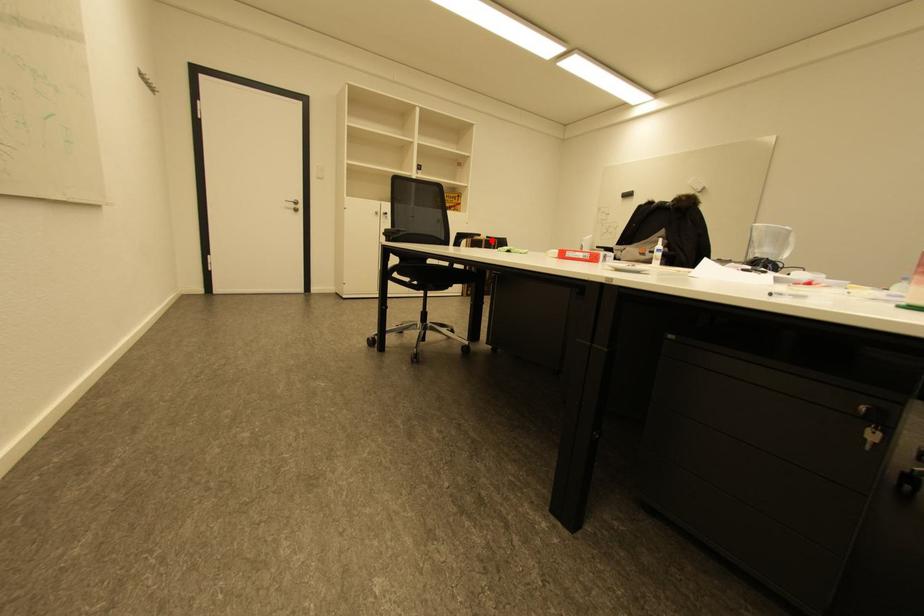
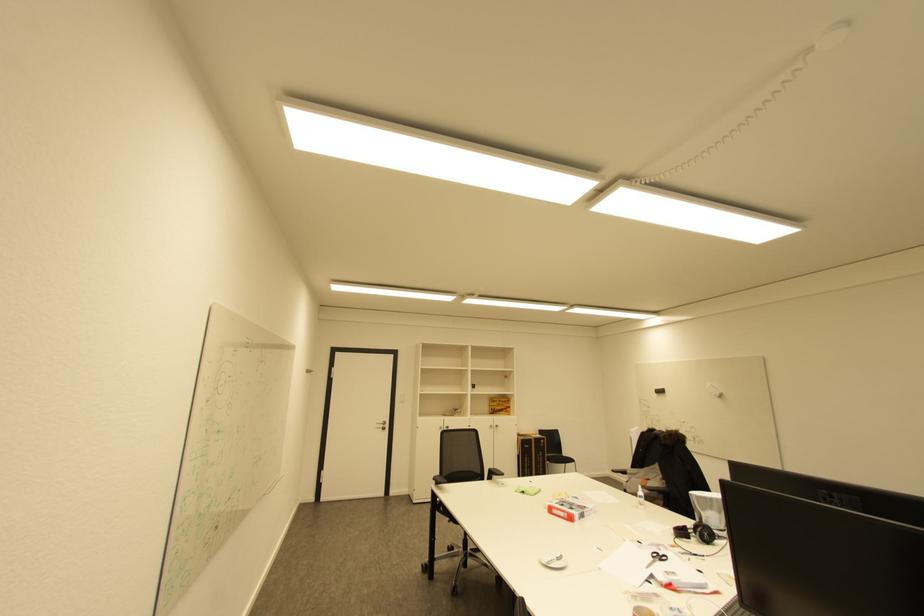
Question: A red point is marked in image1. In image2, is the corresponding 3D point closer to the camera or farther? Reply with the corresponding letter.

Choices:
 (A) The corresponding 3D point is closer.
 (B) The corresponding 3D point is farther.

Answer: (B)